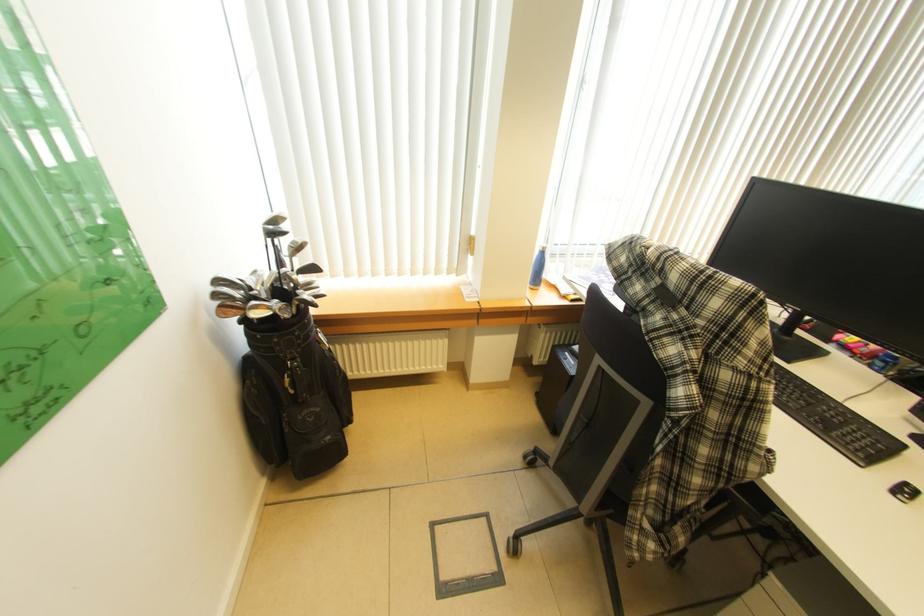
You are a GUI agent. You are given a task and a screenshot of the screen. Output one action in this format:
    pyautogui.click(x=<x>, y=<y>)
    Task: Click on the black computer mouse
    The width and height of the screenshot is (924, 616).
    Given the screenshot: What is the action you would take?
    pyautogui.click(x=904, y=492)